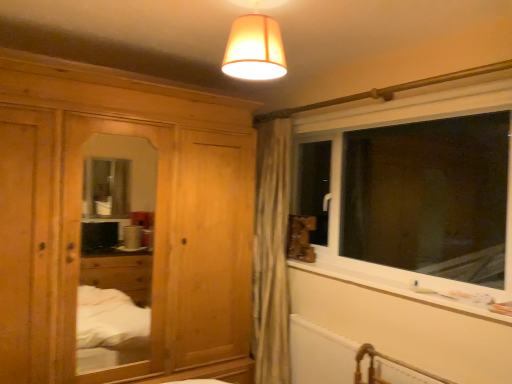
Question: Considering the relative sizes of white plastic window sill at lower right and white matte radiator at lower right in the image provided, is white plastic window sill at lower right smaller than white matte radiator at lower right?

Choices:
 (A) no
 (B) yes

Answer: (B)

Question: From a real-world perspective, is white plastic window sill at lower right physically below white matte radiator at lower right?

Choices:
 (A) no
 (B) yes

Answer: (A)

Question: From a real-world perspective, is white plastic window sill at lower right on white matte radiator at lower right?

Choices:
 (A) yes
 (B) no

Answer: (A)

Question: Considering the relative positions of white plastic window sill at lower right and white matte radiator at lower right in the image provided, is white plastic window sill at lower right in front of white matte radiator at lower right?

Choices:
 (A) no
 (B) yes

Answer: (B)

Question: Would you say white plastic window sill at lower right is outside white matte radiator at lower right?

Choices:
 (A) no
 (B) yes

Answer: (B)

Question: Is white plastic window sill at lower right with white matte radiator at lower right?

Choices:
 (A) yes
 (B) no

Answer: (B)

Question: Does matte orange fabric lampshade at upper center have a smaller size compared to natural wood wardrobe at left?

Choices:
 (A) yes
 (B) no

Answer: (A)

Question: Is matte orange fabric lampshade at upper center positioned far away from natural wood wardrobe at left?

Choices:
 (A) yes
 (B) no

Answer: (A)

Question: Is the position of matte orange fabric lampshade at upper center less distant than that of natural wood wardrobe at left?

Choices:
 (A) yes
 (B) no

Answer: (A)

Question: Is matte orange fabric lampshade at upper center taller than natural wood wardrobe at left?

Choices:
 (A) no
 (B) yes

Answer: (A)

Question: Is matte orange fabric lampshade at upper center at the right side of natural wood wardrobe at left?

Choices:
 (A) no
 (B) yes

Answer: (B)

Question: Can we say matte orange fabric lampshade at upper center lies outside natural wood wardrobe at left?

Choices:
 (A) yes
 (B) no

Answer: (A)

Question: Does white plastic window at right have a greater width compared to natural wood wardrobe at left?

Choices:
 (A) yes
 (B) no

Answer: (B)